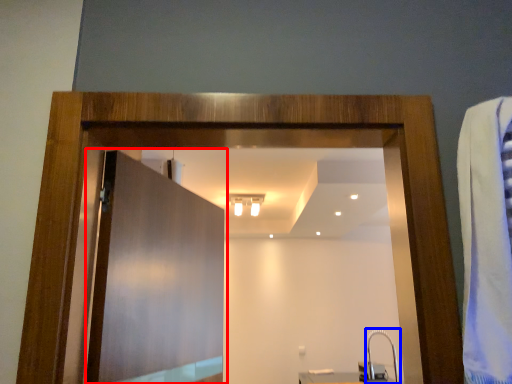
Question: Which object is closer to the camera taking this photo, door (highlighted by a red box) or faucet (highlighted by a blue box)?

Choices:
 (A) door
 (B) faucet

Answer: (A)